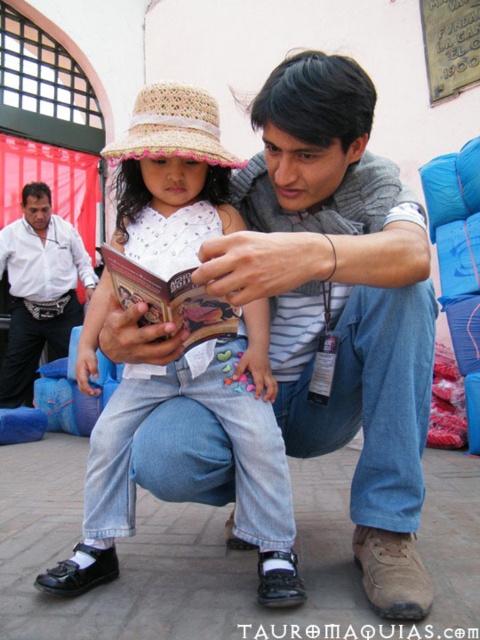
The height and width of the screenshot is (640, 480). I want to click on white shirt at left, so click(x=39, y=289).

Between white shirt at left and hardcover book at center, which one appears on the left side from the viewer's perspective?

white shirt at left is more to the left.

Between point (24, 397) and point (188, 275), which one is positioned behind?

Positioned behind is point (24, 397).

Find the location of a particular element. white shirt at left is located at coordinates (39, 289).

Who is more distant from viewer, (146, 131) or (228, 305)?

The point (146, 131) is behind.

Is point (151, 147) positioned after point (201, 340)?

Yes, point (151, 147) is behind point (201, 340).

This screenshot has height=640, width=480. In order to click on strawmaterial/texturehat at upper center in this screenshot , I will do `click(172, 129)`.

Who is lower down, white lace dress at center or hardcover book at center?

white lace dress at center is lower down.

The height and width of the screenshot is (640, 480). What do you see at coordinates (232, 452) in the screenshot?
I see `white lace dress at center` at bounding box center [232, 452].

Which is behind, point (106, 416) or point (233, 314)?

Positioned behind is point (106, 416).

Locate an element on the screen. The image size is (480, 640). white lace dress at center is located at coordinates (232, 452).